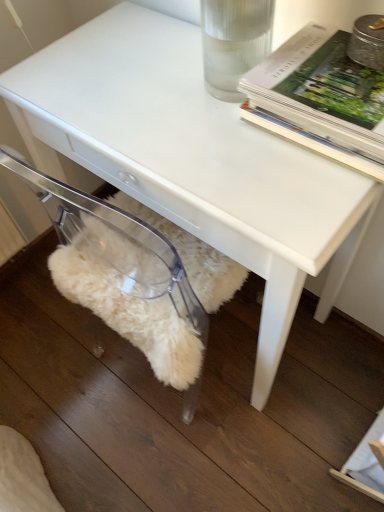
You are a GUI agent. You are given a task and a screenshot of the screen. Output one action in this format:
    pyautogui.click(x=<x>, y=<y>)
    Task: Click on the vacant area situated to the left side of transparent acrylic swivel chair at lower left
    
    Given the screenshot: What is the action you would take?
    pyautogui.click(x=56, y=362)